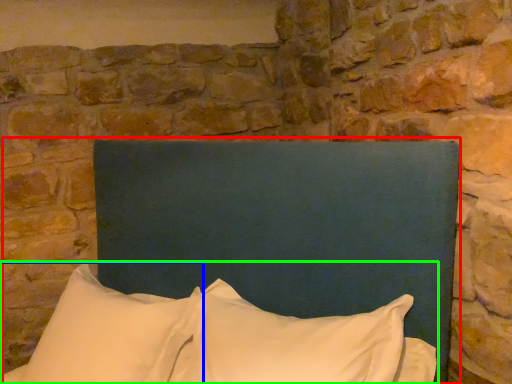
Question: Which object is positioned farthest from bed (highlighted by a red box)? Select from pillow (highlighted by a blue box) and pillow (highlighted by a green box).

Choices:
 (A) pillow
 (B) pillow

Answer: (A)